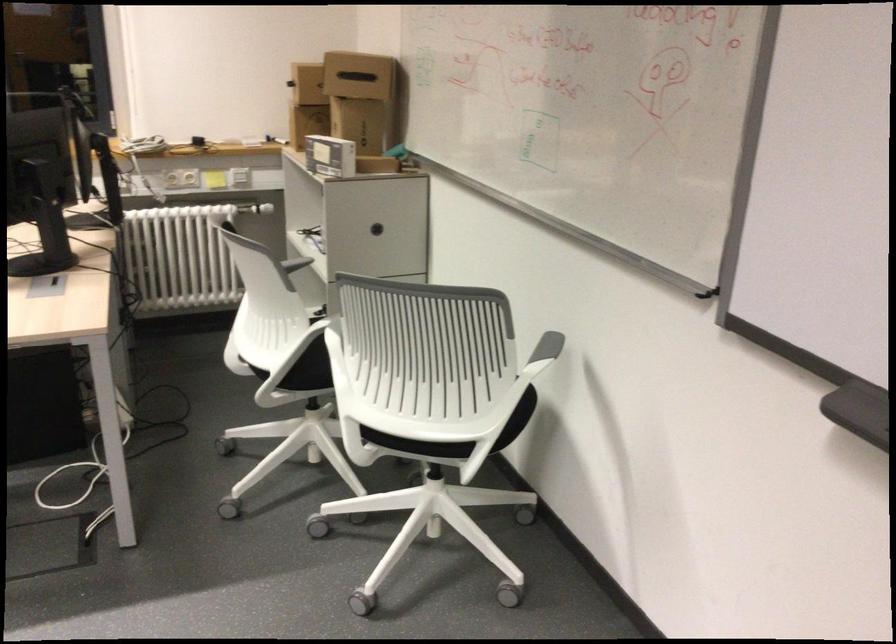
This screenshot has height=644, width=896. Describe the element at coordinates (375, 229) in the screenshot. I see `a round cabinet handle` at that location.